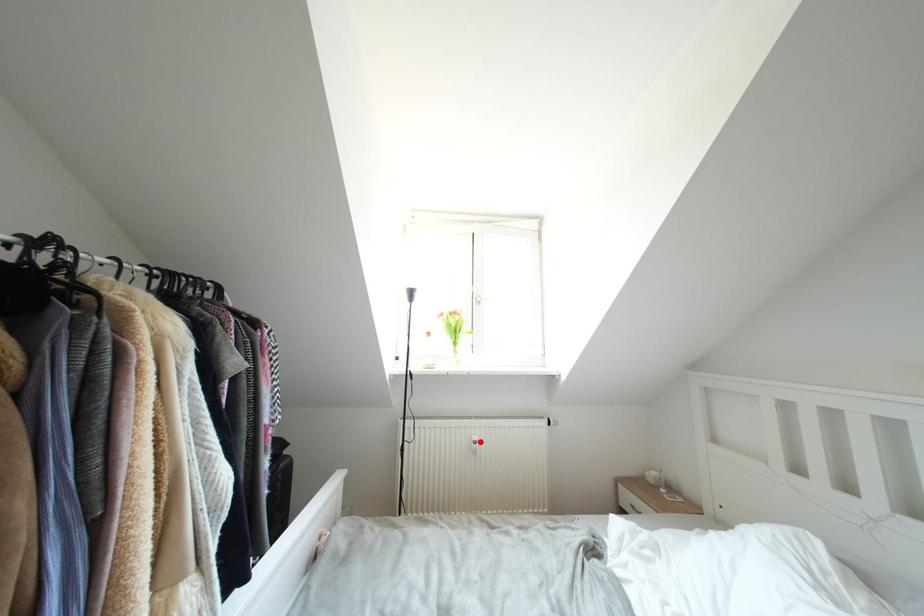
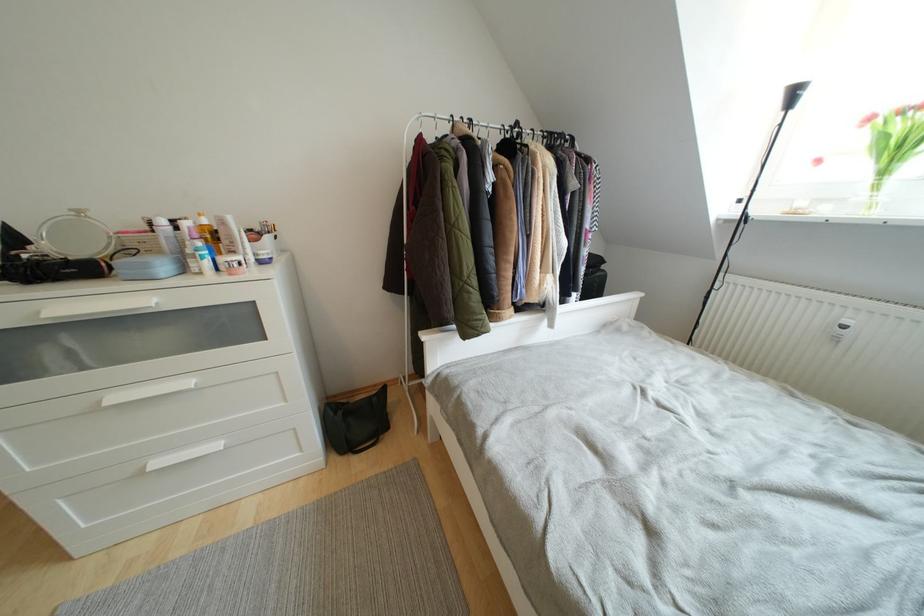
Question: I am providing you with two images of the same scene from different viewpoints. A red point is marked on the first image. At the location where the point appears in image 1, is it still visible in image 2?

Choices:
 (A) Yes
 (B) No

Answer: (A)